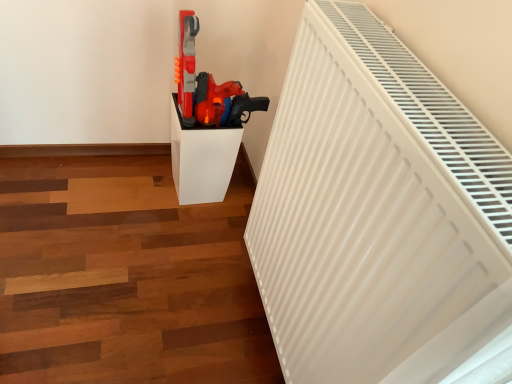
Question: From the image's perspective, is matte plastic toy gun at center above or below white matte radiator at upper right?

Choices:
 (A) above
 (B) below

Answer: (A)

Question: Is point (229, 84) closer or farther from the camera than point (369, 144)?

Choices:
 (A) farther
 (B) closer

Answer: (A)

Question: Which object is the closest to the matte plastic toy gun at center?

Choices:
 (A) white glossy pedestal at center
 (B) matte plastic toy gun at center
 (C) matte plastic toy gun at center
 (D) white matte radiator at upper right

Answer: (B)

Question: Estimate the real-world distances between objects in this image. Which object is farther from the white glossy pedestal at center?

Choices:
 (A) matte plastic toy gun at center
 (B) white matte radiator at upper right
 (C) matte plastic toy gun at center
 (D) matte plastic toy gun at center

Answer: (B)